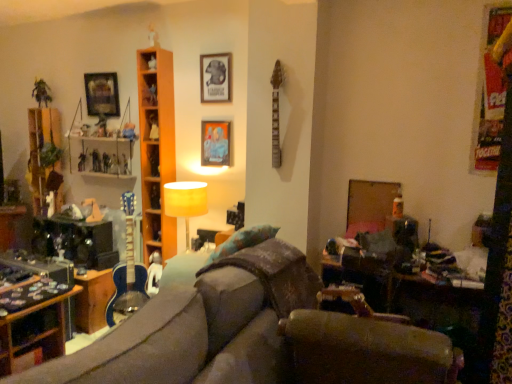
Question: From a real-world perspective, is metallic figure at left, which is the first toy from left to right, under matte wooden picture frame at center, placed as the second picture frame when sorted from front to back?

Choices:
 (A) no
 (B) yes

Answer: (B)

Question: Is metallic figure at left, which is the first toy from left to right, at the left side of matte wooden picture frame at center, the 2th picture frame viewed from the back?

Choices:
 (A) no
 (B) yes

Answer: (B)

Question: From a real-world perspective, is metallic figure at left, which is the first toy from left to right, positioned over matte wooden picture frame at center, which is the second picture frame in left-to-right order, based on gravity?

Choices:
 (A) no
 (B) yes

Answer: (A)

Question: Can you confirm if metallic figure at left, positioned as the fifth toy in right-to-left order, is wider than matte wooden picture frame at center, the second picture frame viewed from the right?

Choices:
 (A) no
 (B) yes

Answer: (B)

Question: Is metallic figure at left, positioned as the fifth toy in right-to-left order, to the right of matte wooden picture frame at center, the second picture frame viewed from the right, from the viewer's perspective?

Choices:
 (A) no
 (B) yes

Answer: (A)

Question: Does metallic figure at left, which is the first toy from left to right, have a lesser width compared to matte wooden picture frame at center, the second picture frame viewed from the right?

Choices:
 (A) no
 (B) yes

Answer: (A)

Question: Is the depth of matte wooden picture frame at center, which is the second picture frame in left-to-right order, greater than that of metallic silver picture frame at upper left, positioned as the 1th picture frame in left-to-right order?

Choices:
 (A) no
 (B) yes

Answer: (A)

Question: Considering the relative sizes of matte wooden picture frame at center, the second picture frame viewed from the right, and metallic silver picture frame at upper left, the 3th picture frame positioned from the front, in the image provided, is matte wooden picture frame at center, the second picture frame viewed from the right, bigger than metallic silver picture frame at upper left, the 3th picture frame positioned from the front,?

Choices:
 (A) no
 (B) yes

Answer: (A)

Question: From the image's perspective, would you say matte wooden picture frame at center, which is the second picture frame in left-to-right order, is positioned over metallic silver picture frame at upper left, the 3th picture frame positioned from the front?

Choices:
 (A) no
 (B) yes

Answer: (A)

Question: Does matte wooden picture frame at center, which is the second picture frame in left-to-right order, have a smaller size compared to metallic silver picture frame at upper left, the 3th picture frame positioned from the front?

Choices:
 (A) yes
 (B) no

Answer: (A)

Question: Would you say metallic silver picture frame at upper left, acting as the 3th picture frame starting from the right, is part of matte wooden picture frame at center, the 2th picture frame viewed from the back,'s contents?

Choices:
 (A) yes
 (B) no

Answer: (B)

Question: Is matte wooden picture frame at center, the 2th picture frame viewed from the back, to the right of metallic silver picture frame at upper left, acting as the 3th picture frame starting from the right, from the viewer's perspective?

Choices:
 (A) no
 (B) yes

Answer: (B)

Question: Is matte black picture frame at upper center, which is counted as the 3th picture frame, starting from the left, a part of metallic silver figurine at upper left, the second toy viewed from the left?

Choices:
 (A) no
 (B) yes

Answer: (A)